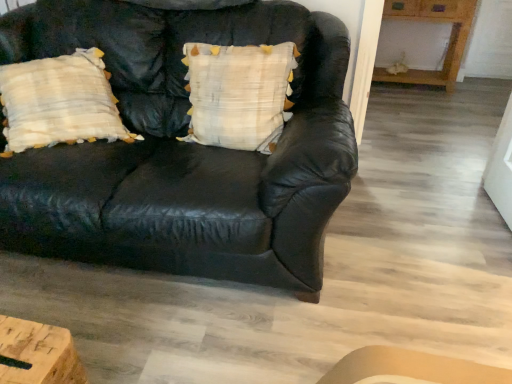
This screenshot has width=512, height=384. In order to click on black leather couch at center in this screenshot , I will do `click(183, 150)`.

Is black leather couch at center positioned with its back to white textured pillow at center?

Absolutely, black leather couch at center is directed away from white textured pillow at center.

Who is smaller, black leather couch at center or white textured pillow at center?

white textured pillow at center.

Where is `pillow that appears above the black leather couch at center (from the image's perspective)`? pillow that appears above the black leather couch at center (from the image's perspective) is located at coordinates (239, 94).

In the image, is black leather couch at center on the left side or the right side of white textured pillow at center?

From the image, it's evident that black leather couch at center is to the left of white textured pillow at center.

Between point (205, 103) and point (456, 4), which one is positioned behind?

Positioned behind is point (456, 4).

Where is `table below the white textured pillow at center (from a real-world perspective)`? The width and height of the screenshot is (512, 384). table below the white textured pillow at center (from a real-world perspective) is located at coordinates coord(448,43).

From a real-world perspective, which is physically above, white textured pillow at center or wooden table at upper right?

white textured pillow at center is physically above.

Which object is wider, wooden table at upper right or white textured pillow at center?

wooden table at upper right.

From the image's perspective, is wooden table at upper right beneath white textured pillow at center?

No, from the image's perspective, wooden table at upper right is not beneath white textured pillow at center.

Which object is positioned more to the left, wooden table at upper right or white textured pillow at center?

white textured pillow at center is more to the left.

From a real-world perspective, is wooden table at upper right positioned above or below white textured pillow at center?

Clearly, from a real-world perspective, wooden table at upper right is below white textured pillow at center.

Is white textured pillow at center wider than black leather couch at center?

No.

Is white textured pillow at center positioned far away from black leather couch at center?

Actually, white textured pillow at center and black leather couch at center are a little close together.

You are a GUI agent. You are given a task and a screenshot of the screen. Output one action in this format:
    pyautogui.click(x=<x>, y=<y>)
    Task: Click on the studio couch that appears on the left of white textured pillow at center
    
    Given the screenshot: What is the action you would take?
    pyautogui.click(x=183, y=150)

Which is more to the right, white textured pillow at center or black leather couch at center?

white textured pillow at center is more to the right.

Which object is positioned more to the right, wooden table at upper right or black leather couch at center?

wooden table at upper right.

From the image's perspective, is wooden table at upper right located beneath black leather couch at center?

Incorrect, from the image's perspective, wooden table at upper right is higher than black leather couch at center.

In the scene shown: Is wooden table at upper right not near black leather couch at center?

Yes.

Considering the sizes of objects black leather couch at center and wooden table at upper right in the image provided, who is taller, black leather couch at center or wooden table at upper right?

Standing taller between the two is black leather couch at center.

At what (x,y) coordinates should I click in order to perform the action: click on studio couch on the left of wooden table at upper right. Please return your answer as a coordinate pair (x, y). The width and height of the screenshot is (512, 384). Looking at the image, I should click on (183, 150).

From a real-world perspective, which object stands above the other?

black leather couch at center.

Which point is more forward, (59, 194) or (436, 73)?

The point (59, 194) is closer to the camera.

You are a GUI agent. You are given a task and a screenshot of the screen. Output one action in this format:
    pyautogui.click(x=<x>, y=<y>)
    Task: Click on the studio couch below the white textured pillow at center (from the image's perspective)
    Image resolution: width=512 pixels, height=384 pixels.
    Given the screenshot: What is the action you would take?
    pyautogui.click(x=183, y=150)

You are a GUI agent. You are given a task and a screenshot of the screen. Output one action in this format:
    pyautogui.click(x=<x>, y=<y>)
    Task: Click on the table lying behind the white textured pillow at center
    The width and height of the screenshot is (512, 384).
    Given the screenshot: What is the action you would take?
    pyautogui.click(x=448, y=43)

Based on their spatial positions, is wooden table at upper right or white textured pillow at center closer to black leather couch at center?

white textured pillow at center.

Looking at the image, which one is located closer to black leather couch at center, white textured pillow at center or wooden table at upper right?

Among the two, white textured pillow at center is located nearer to black leather couch at center.

Which object lies further to the anchor point white textured pillow at center, black leather couch at center or wooden table at upper right?

wooden table at upper right is positioned further to the anchor white textured pillow at center.

Which object lies nearer to the anchor point wooden table at upper right, black leather couch at center or white textured pillow at center?

white textured pillow at center is positioned closer to the anchor wooden table at upper right.

Which object lies nearer to the anchor point wooden table at upper right, white textured pillow at center or black leather couch at center?

Based on the image, white textured pillow at center appears to be nearer to wooden table at upper right.

Estimate the real-world distances between objects in this image. Which object is further from white textured pillow at center, wooden table at upper right or black leather couch at center?

The object further to white textured pillow at center is wooden table at upper right.

In order to click on pillow positioned between black leather couch at center and wooden table at upper right from near to far in this screenshot , I will do `click(239, 94)`.